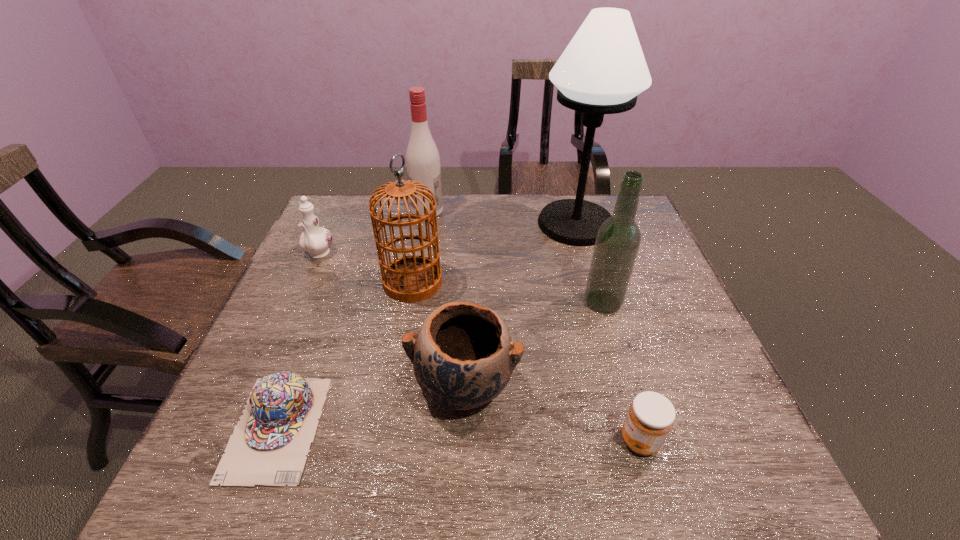
The width and height of the screenshot is (960, 540). In order to click on blank space that satisfies the following two spatial constraints: 1. on the back side of the liquor; 2. on the label of the alcohol in this screenshot , I will do `click(575, 211)`.

Image resolution: width=960 pixels, height=540 pixels. Find the location of `free spot that satisfies the following two spatial constraints: 1. on the label of the alcohol; 2. on the left side of the tallest object`. free spot that satisfies the following two spatial constraints: 1. on the label of the alcohol; 2. on the left side of the tallest object is located at coordinates (425, 224).